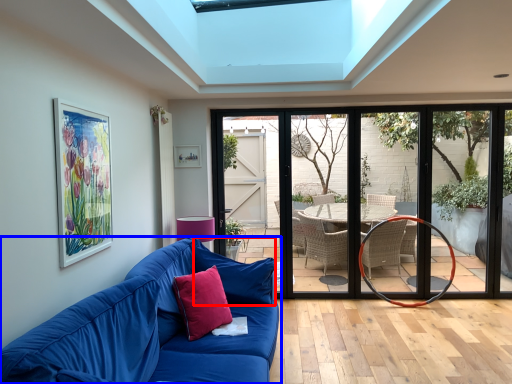
Question: Which point is further to the camera, pillow (highlighted by a red box) or studio couch (highlighted by a blue box)?

Choices:
 (A) pillow
 (B) studio couch

Answer: (A)